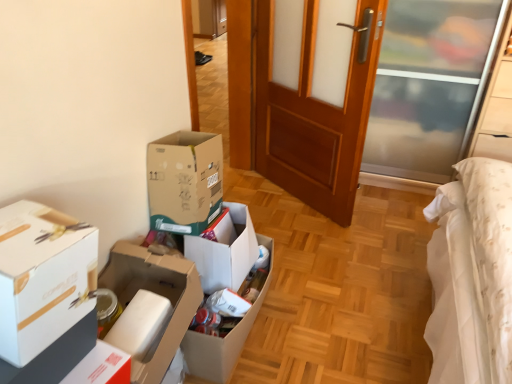
The image size is (512, 384). Find the location of `free region on the left part of wooden door at center`. free region on the left part of wooden door at center is located at coordinates (268, 199).